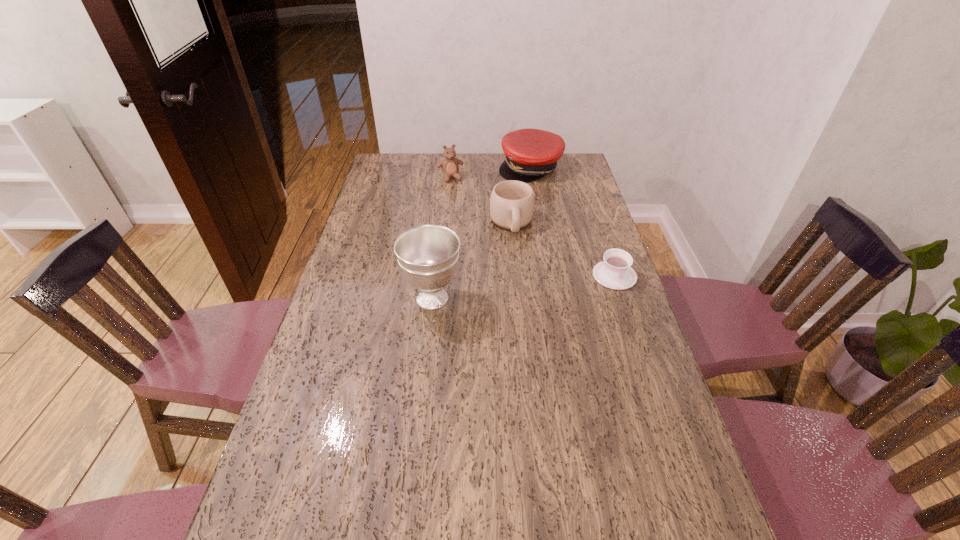
At what (x,y) coordinates should I click in order to perform the action: click on free space between the tallest object and the third nearest object. Please return your answer as a coordinate pair (x, y). Image resolution: width=960 pixels, height=540 pixels. Looking at the image, I should click on (472, 261).

This screenshot has width=960, height=540. Identify the location of unoccupied position between the third farthest object and the chalice. point(472,261).

The image size is (960, 540). I want to click on free space between the tallest object and the mug, so click(472, 261).

Identify the location of vacant space that's between the chalice and the cap. The image size is (960, 540). (481, 233).

Locate an element on the screen. The image size is (960, 540). free space between the teddy bear and the mug is located at coordinates (481, 200).

You are a GUI agent. You are given a task and a screenshot of the screen. Output one action in this format:
    pyautogui.click(x=<x>, y=<y>)
    Task: Click on the object that stands as the closest to the mug
    
    Given the screenshot: What is the action you would take?
    pyautogui.click(x=530, y=154)

Identify which object is the nearest to the chalice. Please provide its 2D coordinates. Your answer should be formatted as a tuple, i.e. [(x, y)], where the tuple contains the x and y coordinates of a point satisfying the conditions above.

[(512, 203)]

This screenshot has height=540, width=960. What are the coordinates of `free spot that satisfies the following two spatial constraints: 1. on the front side of the teddy bear; 2. on the right side of the third farthest object` in the screenshot? It's located at (445, 223).

This screenshot has width=960, height=540. In order to click on vacant position in the image that satisfies the following two spatial constraints: 1. on the back side of the cap; 2. on the left side of the tallest object in this screenshot , I will do `click(447, 168)`.

This screenshot has height=540, width=960. Find the location of `vacant space that satisfies the following two spatial constraints: 1. on the back side of the cap; 2. on the left side of the teddy bear`. vacant space that satisfies the following two spatial constraints: 1. on the back side of the cap; 2. on the left side of the teddy bear is located at coordinates (451, 168).